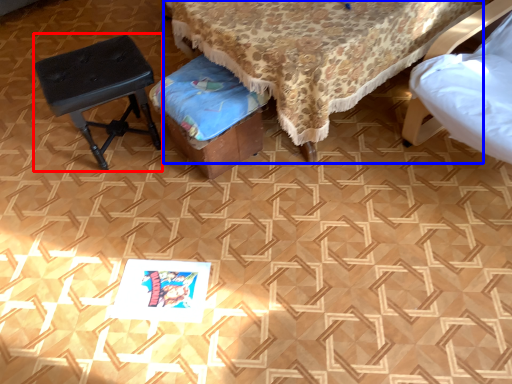
Question: Which object appears closest to the camera in this image, stool (highlighted by a red box) or furniture (highlighted by a blue box)?

Choices:
 (A) stool
 (B) furniture

Answer: (B)